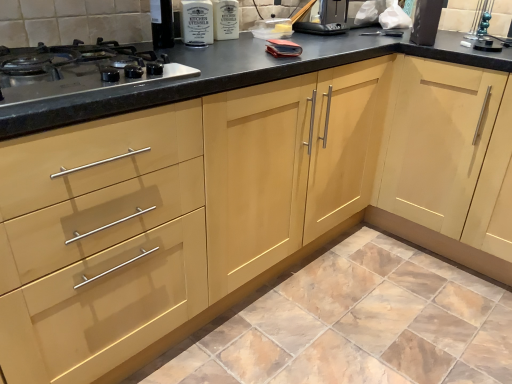
What do you see at coordinates (437, 157) in the screenshot? The height and width of the screenshot is (384, 512). I see `light wood cabinet at center` at bounding box center [437, 157].

This screenshot has width=512, height=384. Describe the element at coordinates (326, 18) in the screenshot. I see `black plastic toaster at upper center, positioned as the 1th appliance in back-to-front order` at that location.

Measure the distance between black plastic toaster at upper center, which appears as the 2th appliance when viewed from the right, and camera.

black plastic toaster at upper center, which appears as the 2th appliance when viewed from the right, and camera are 1.80 meters apart.

I want to click on stainless steel gas stove at left, so click(x=78, y=70).

Image resolution: width=512 pixels, height=384 pixels. I want to click on matte ceramic tile at lower center, so click(348, 320).

Where is `light wood cabinet at center`? The width and height of the screenshot is (512, 384). light wood cabinet at center is located at coordinates (437, 157).

Do you think black plastic toaster at upper center, which appears as the 2th appliance when viewed from the right, is within light wood cabinet at center, or outside of it?

black plastic toaster at upper center, which appears as the 2th appliance when viewed from the right, exists outside the volume of light wood cabinet at center.

From the image's perspective, which is above, black plastic toaster at upper center, positioned as the 1th appliance in back-to-front order, or light wood cabinet at center?

black plastic toaster at upper center, positioned as the 1th appliance in back-to-front order, is shown above in the image.

Are black plastic toaster at upper center, positioned as the 1th appliance in back-to-front order, and light wood cabinet at center located far from each other?

black plastic toaster at upper center, positioned as the 1th appliance in back-to-front order, is actually quite close to light wood cabinet at center.

Which object is more forward, black plastic toaster at upper center, positioned as the 1th appliance in back-to-front order, or light wood cabinet at center?

light wood cabinet at center is closer to the camera.

Which is more to the left, black matte toaster at upper right, which is counted as the 2th appliance, starting from the back, or stainless steel gas stove at left?

Positioned to the left is stainless steel gas stove at left.

From the image's perspective, is black matte toaster at upper right, acting as the 2th appliance starting from the left, above or below stainless steel gas stove at left?

black matte toaster at upper right, acting as the 2th appliance starting from the left, is situated higher than stainless steel gas stove at left in the image.

Measure the distance between black matte toaster at upper right, acting as the first appliance starting from the right, and stainless steel gas stove at left.

A distance of 1.21 meters exists between black matte toaster at upper right, acting as the first appliance starting from the right, and stainless steel gas stove at left.

Is point (434, 31) in front of point (28, 96)?

No.

Based on their sizes in the image, would you say stainless steel gas stove at left is bigger or smaller than black plastic toaster at upper center, which appears as the 2th appliance when viewed from the right?

stainless steel gas stove at left is bigger than black plastic toaster at upper center, which appears as the 2th appliance when viewed from the right.

This screenshot has height=384, width=512. Find the location of `gas stove below the black plastic toaster at upper center, positioned as the 1th appliance in back-to-front order (from a real-world perspective)`. gas stove below the black plastic toaster at upper center, positioned as the 1th appliance in back-to-front order (from a real-world perspective) is located at coordinates (78, 70).

Is stainless steel gas stove at left positioned far away from black plastic toaster at upper center, positioned as the 1th appliance in back-to-front order?

Actually, stainless steel gas stove at left and black plastic toaster at upper center, positioned as the 1th appliance in back-to-front order, are a little close together.

Could you tell me if stainless steel gas stove at left is turned towards black plastic toaster at upper center, positioned as the 2th appliance in front-to-back order?

No.

Which of these two, black matte toaster at upper right, which is counted as the first appliance, starting from the front, or black plastic toaster at upper center, positioned as the 2th appliance in front-to-back order, stands shorter?

With less height is black plastic toaster at upper center, positioned as the 2th appliance in front-to-back order.

Considering the points (429, 30) and (328, 2), which point is behind, point (429, 30) or point (328, 2)?

Point (328, 2)

Is black matte toaster at upper right, acting as the first appliance starting from the right, facing away from black plastic toaster at upper center, positioned as the 1th appliance in back-to-front order?

black matte toaster at upper right, acting as the first appliance starting from the right, does not have its back to black plastic toaster at upper center, positioned as the 1th appliance in back-to-front order.

Considering the sizes of objects stainless steel gas stove at left and black matte toaster at upper right, acting as the first appliance starting from the right, in the image provided, who is thinner, stainless steel gas stove at left or black matte toaster at upper right, acting as the first appliance starting from the right,?

black matte toaster at upper right, acting as the first appliance starting from the right, is thinner.

Between stainless steel gas stove at left and black matte toaster at upper right, which is counted as the 2th appliance, starting from the back, which one has less height?

stainless steel gas stove at left is shorter.

The image size is (512, 384). Identify the location of appliance that is the 1st object located above the stainless steel gas stove at left (from the image's perspective). (426, 22).

Where is `cabinetry behind the matte ceramic tile at lower center`? cabinetry behind the matte ceramic tile at lower center is located at coordinates (437, 157).

Considering the sizes of light wood cabinet at center and matte ceramic tile at lower center in the image, is light wood cabinet at center wider or thinner than matte ceramic tile at lower center?

Clearly, light wood cabinet at center has less width compared to matte ceramic tile at lower center.

Which object is further away from the camera, light wood cabinet at center or matte ceramic tile at lower center?

light wood cabinet at center is more distant.

Measure the distance between light wood cabinet at center and matte ceramic tile at lower center.

A distance of 21.18 inches exists between light wood cabinet at center and matte ceramic tile at lower center.

How many degrees apart are the facing directions of matte ceramic tile at lower center and stainless steel gas stove at left?

180 degrees.

Which of these two, matte ceramic tile at lower center or stainless steel gas stove at left, stands taller?

With more height is stainless steel gas stove at left.

Is matte ceramic tile at lower center wider than stainless steel gas stove at left?

Indeed, matte ceramic tile at lower center has a greater width compared to stainless steel gas stove at left.

Considering the sizes of objects matte ceramic tile at lower center and stainless steel gas stove at left in the image provided, who is bigger, matte ceramic tile at lower center or stainless steel gas stove at left?

matte ceramic tile at lower center.

The width and height of the screenshot is (512, 384). I want to click on cabinetry that is in front of the black plastic toaster at upper center, positioned as the 1th appliance in back-to-front order, so click(437, 157).

The height and width of the screenshot is (384, 512). In the image, there is a black matte toaster at upper right, acting as the 2th appliance starting from the left. In order to click on gas stove below it (from the image's perspective) in this screenshot , I will do `click(78, 70)`.

Estimate the real-world distances between objects in this image. Which object is closer to stainless steel gas stove at left, black plastic toaster at upper center, the 1th appliance viewed from the left, or light wood cabinet at center?

black plastic toaster at upper center, the 1th appliance viewed from the left, lies closer to stainless steel gas stove at left than the other object.

Looking at the image, which one is located further to black plastic toaster at upper center, positioned as the 2th appliance in front-to-back order, light wood cabinet at center or black matte toaster at upper right, acting as the 2th appliance starting from the left?

Based on the image, light wood cabinet at center appears to be further to black plastic toaster at upper center, positioned as the 2th appliance in front-to-back order.

Looking at the image, which one is located further to black plastic toaster at upper center, positioned as the 1th appliance in back-to-front order, light wood cabinet at center or stainless steel gas stove at left?

stainless steel gas stove at left.

Which object lies nearer to the anchor point stainless steel gas stove at left, light wood cabinet at center or black matte toaster at upper right, which is counted as the 2th appliance, starting from the back?

Based on the image, light wood cabinet at center appears to be nearer to stainless steel gas stove at left.

When comparing their distances from black matte toaster at upper right, acting as the 2th appliance starting from the left, does stainless steel gas stove at left or light wood cabinet at center seem further?

The object further to black matte toaster at upper right, acting as the 2th appliance starting from the left, is stainless steel gas stove at left.

Estimate the real-world distances between objects in this image. Which object is closer to black plastic toaster at upper center, the 1th appliance viewed from the left, matte ceramic tile at lower center or black matte toaster at upper right, which is counted as the first appliance, starting from the front?

black matte toaster at upper right, which is counted as the first appliance, starting from the front, lies closer to black plastic toaster at upper center, the 1th appliance viewed from the left, than the other object.

Based on their spatial positions, is matte ceramic tile at lower center or black plastic toaster at upper center, positioned as the 2th appliance in front-to-back order, further from stainless steel gas stove at left?

The object further to stainless steel gas stove at left is matte ceramic tile at lower center.

From the image, which object appears to be farther from black plastic toaster at upper center, positioned as the 2th appliance in front-to-back order, matte ceramic tile at lower center or stainless steel gas stove at left?

matte ceramic tile at lower center lies further to black plastic toaster at upper center, positioned as the 2th appliance in front-to-back order, than the other object.

Where is `cabinetry between black matte toaster at upper right, which is counted as the 2th appliance, starting from the back, and matte ceramic tile at lower center in the up-down direction`? This screenshot has height=384, width=512. cabinetry between black matte toaster at upper right, which is counted as the 2th appliance, starting from the back, and matte ceramic tile at lower center in the up-down direction is located at coordinates (437, 157).

Where is `gas stove that lies between black matte toaster at upper right, acting as the 2th appliance starting from the left, and matte ceramic tile at lower center from top to bottom`? The width and height of the screenshot is (512, 384). gas stove that lies between black matte toaster at upper right, acting as the 2th appliance starting from the left, and matte ceramic tile at lower center from top to bottom is located at coordinates point(78,70).

Where is `cabinetry that lies between black plastic toaster at upper center, positioned as the 2th appliance in front-to-back order, and matte ceramic tile at lower center from top to bottom`? Image resolution: width=512 pixels, height=384 pixels. cabinetry that lies between black plastic toaster at upper center, positioned as the 2th appliance in front-to-back order, and matte ceramic tile at lower center from top to bottom is located at coordinates (437, 157).

Image resolution: width=512 pixels, height=384 pixels. Identify the location of appliance between black plastic toaster at upper center, positioned as the 2th appliance in front-to-back order, and light wood cabinet at center from left to right. (426, 22).